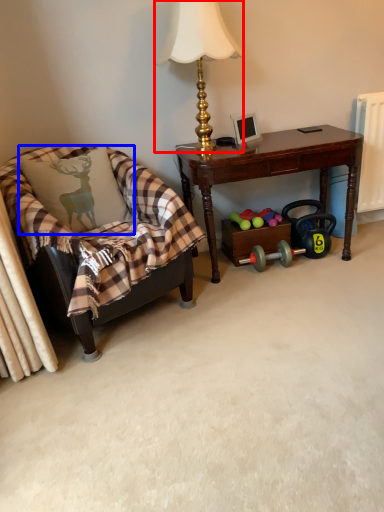
Question: Which object is further to the camera taking this photo, lamp (highlighted by a red box) or pillow (highlighted by a blue box)?

Choices:
 (A) lamp
 (B) pillow

Answer: (B)